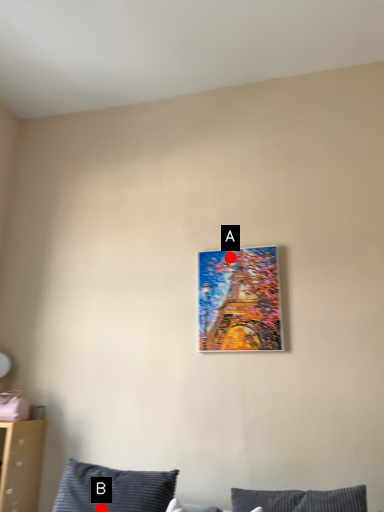
Question: Two points are circled on the image, labeled by A and B beside each circle. Among these points, which one is farthest from the camera?

Choices:
 (A) A is further
 (B) B is further

Answer: (A)